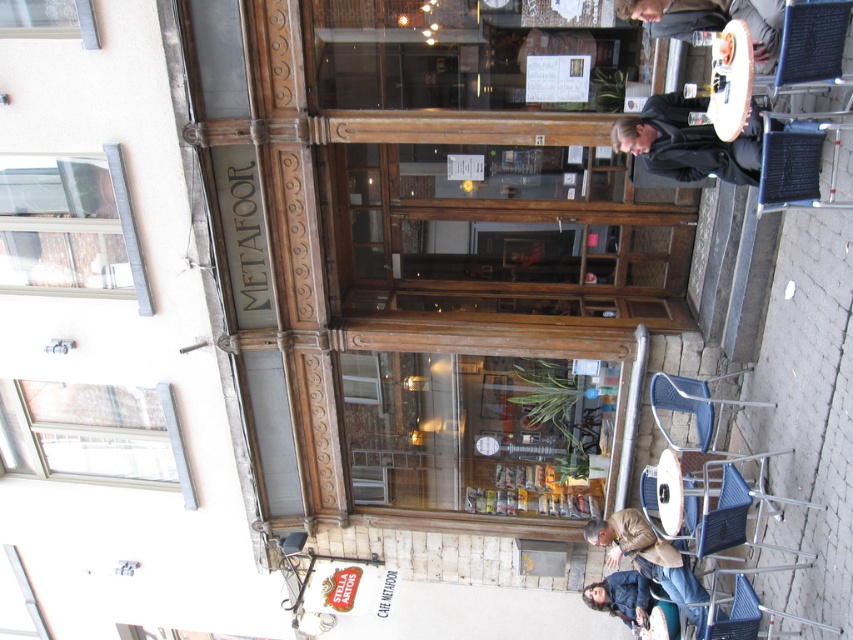
You are standing in front of the Metafoor cafe. You want to locate the white plastic window at upper left. Where should you look relative to the cafe entrance?

The white plastic window at upper left is located at point (93,433) relative to the cafe entrance.